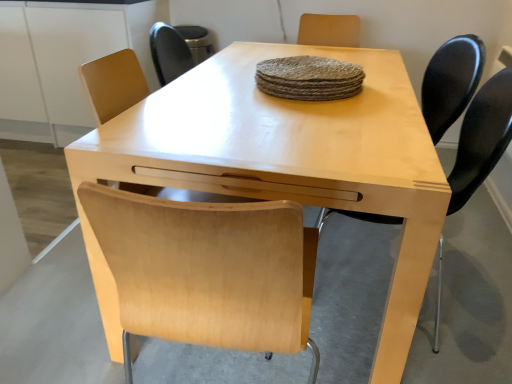
Question: Considering the relative sizes of light wood table at center and matte black chair at right, positioned as the 2th chair in back-to-front order, in the image provided, is light wood table at center thinner than matte black chair at right, positioned as the 2th chair in back-to-front order,?

Choices:
 (A) no
 (B) yes

Answer: (A)

Question: Is light wood table at center facing towards matte black chair at right, positioned as the 2th chair in back-to-front order?

Choices:
 (A) no
 (B) yes

Answer: (A)

Question: From the image's perspective, is light wood table at center below matte black chair at right, the 1th chair positioned from the front?

Choices:
 (A) yes
 (B) no

Answer: (A)

Question: From the image's perspective, is light wood table at center above matte black chair at right, the 1th chair positioned from the front?

Choices:
 (A) no
 (B) yes

Answer: (A)

Question: Is light wood table at center to the left of matte black chair at right, positioned as the 2th chair in back-to-front order, from the viewer's perspective?

Choices:
 (A) yes
 (B) no

Answer: (A)

Question: In the image, is matte black chair at right, the first chair when ordered from back to front, positioned in front of or behind matte black chair at right, positioned as the 2th chair in back-to-front order?

Choices:
 (A) front
 (B) behind

Answer: (B)

Question: From the image's perspective, is matte black chair at right, the 2th chair viewed from the front, positioned above or below matte black chair at right, the 1th chair positioned from the front?

Choices:
 (A) above
 (B) below

Answer: (A)

Question: From a real-world perspective, is matte black chair at right, the 2th chair viewed from the front, above or below matte black chair at right, the 1th chair positioned from the front?

Choices:
 (A) above
 (B) below

Answer: (B)

Question: Is matte black chair at right, the 2th chair viewed from the front, bigger or smaller than matte black chair at right, positioned as the 2th chair in back-to-front order?

Choices:
 (A) big
 (B) small

Answer: (A)

Question: Considering the positions of light wood table at center and matte black chair at right, the first chair when ordered from back to front, in the image, is light wood table at center wider or thinner than matte black chair at right, the first chair when ordered from back to front,?

Choices:
 (A) thin
 (B) wide

Answer: (B)

Question: From a real-world perspective, is light wood table at center physically located above or below matte black chair at right, the first chair when ordered from back to front?

Choices:
 (A) below
 (B) above

Answer: (A)

Question: From their relative heights in the image, would you say light wood table at center is taller or shorter than matte black chair at right, the 2th chair viewed from the front?

Choices:
 (A) tall
 (B) short

Answer: (B)

Question: Considering their positions, is light wood table at center located in front of or behind matte black chair at right, the first chair when ordered from back to front?

Choices:
 (A) behind
 (B) front

Answer: (B)

Question: Is point (462, 97) closer or farther from the camera than point (76, 367)?

Choices:
 (A) farther
 (B) closer

Answer: (A)

Question: From a real-world perspective, relative to light wood table at center, is matte black chair at right, the 2th chair viewed from the front, vertically above or below?

Choices:
 (A) below
 (B) above

Answer: (B)